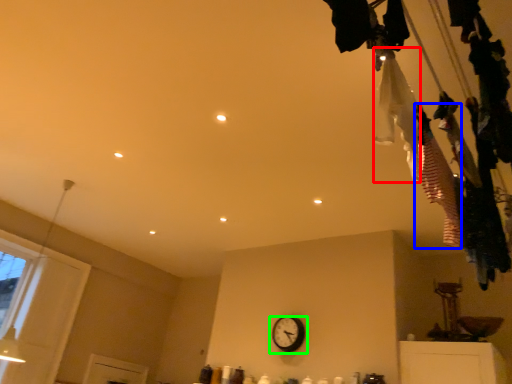
Question: Which object is the closest to the clothing (highlighted by a red box)? Choose among these: clothing (highlighted by a blue box) or wall clock (highlighted by a green box).

Choices:
 (A) clothing
 (B) wall clock

Answer: (A)